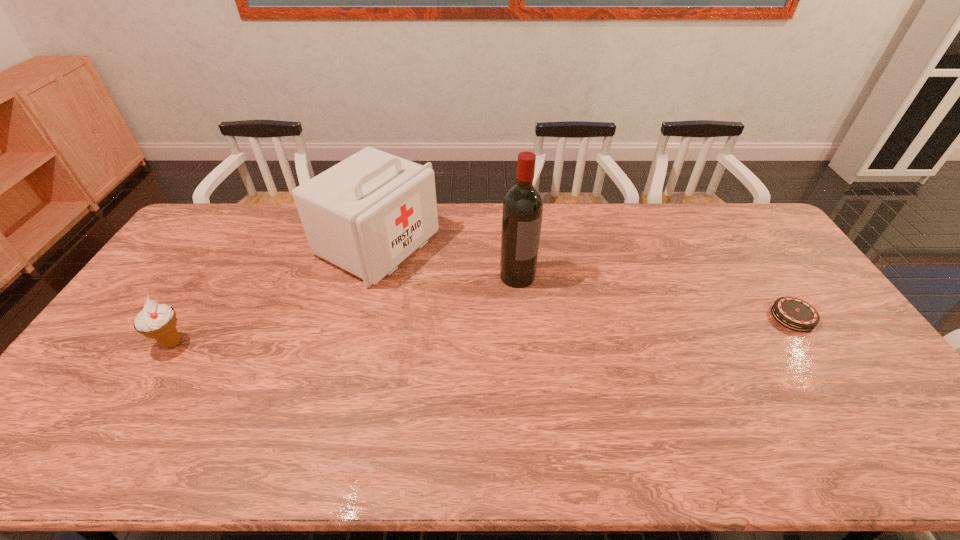
This screenshot has width=960, height=540. Find the location of `icecream`. icecream is located at coordinates (158, 321).

Find the location of `the leftmost object`. the leftmost object is located at coordinates (158, 321).

Image resolution: width=960 pixels, height=540 pixels. Find the location of `the rightmost object`. the rightmost object is located at coordinates (795, 314).

What are the coordinates of `the shortest object` in the screenshot? It's located at (795, 314).

I want to click on the third shortest object, so click(368, 213).

Where is `the first-aid kit`? This screenshot has height=540, width=960. the first-aid kit is located at coordinates (368, 213).

Find the location of a particular element. This screenshot has height=540, width=960. the tallest object is located at coordinates (522, 212).

The width and height of the screenshot is (960, 540). Find the location of `the third object from left to right`. the third object from left to right is located at coordinates (522, 212).

Locate an element on the screen. Image resolution: width=960 pixels, height=540 pixels. free space located 0.310m on the back of the leftmost object is located at coordinates (226, 259).

What are the coordinates of `vacant space positioned 0.150m on the front of the chocolate cake` in the screenshot? It's located at (837, 382).